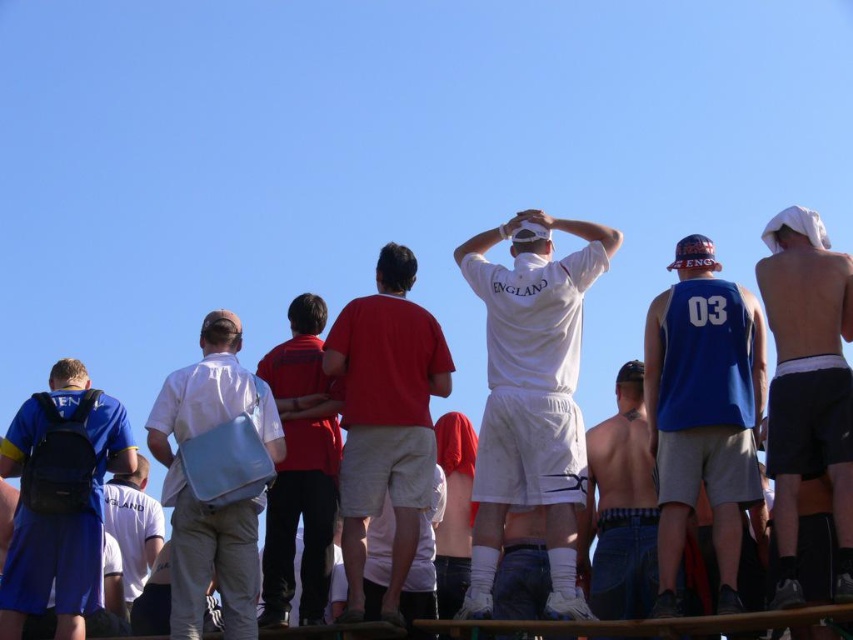
Question: Is red matte shirt at center wider than white cotton shirt at center?

Choices:
 (A) yes
 (B) no

Answer: (A)

Question: Which point is closer to the camera taking this photo?

Choices:
 (A) [x=146, y=508]
 (B) [x=352, y=353]
 (C) [x=560, y=602]

Answer: (C)

Question: Which of the following is the closest to the observer?

Choices:
 (A) white cotton shirt at center
 (B) red matte shirt at center
 (C) light gray fabric bag at center
 (D) blue jersey at center

Answer: (D)

Question: Where is blue jersey at center located in relation to blue fabric backpack at left in the image?

Choices:
 (A) left
 (B) right

Answer: (B)

Question: Estimate the real-world distances between objects in this image. Which object is closer to the blue jersey at center?

Choices:
 (A) light gray fabric bag at center
 (B) red cotton shirt at center

Answer: (B)

Question: Is blue jersey at center below shiny black shorts at right?

Choices:
 (A) yes
 (B) no

Answer: (A)